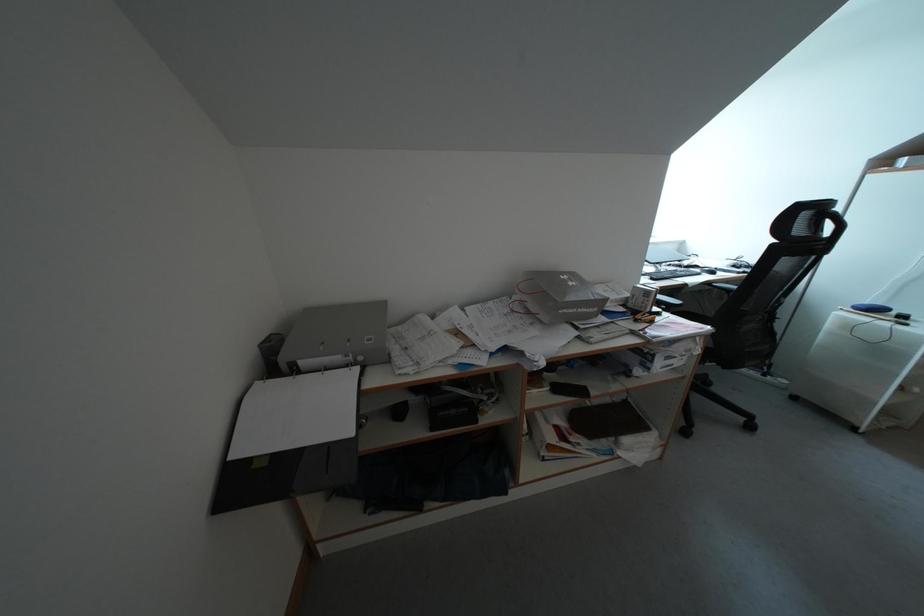
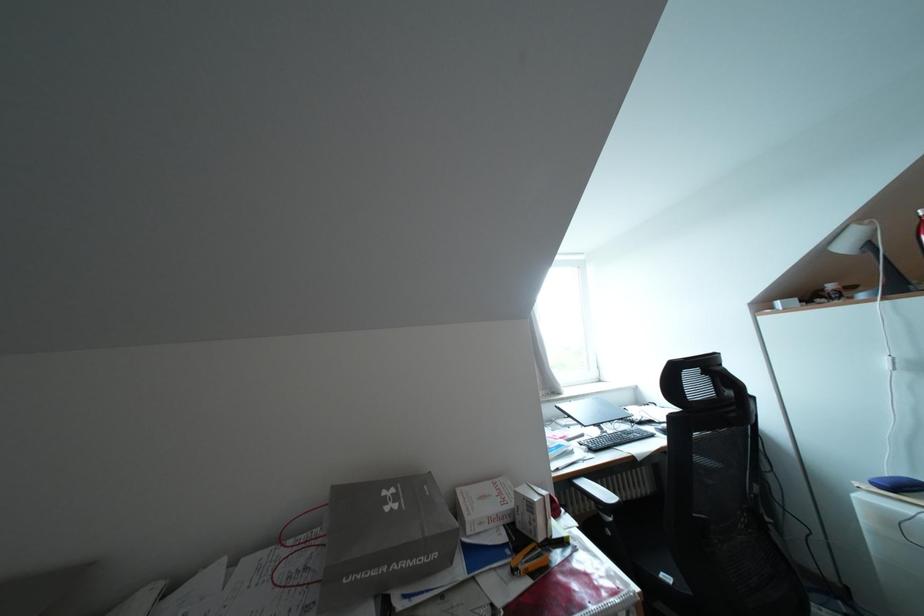
Question: How did the camera likely rotate?

Choices:
 (A) Left
 (B) Right
 (C) Up
 (D) Down

Answer: (C)